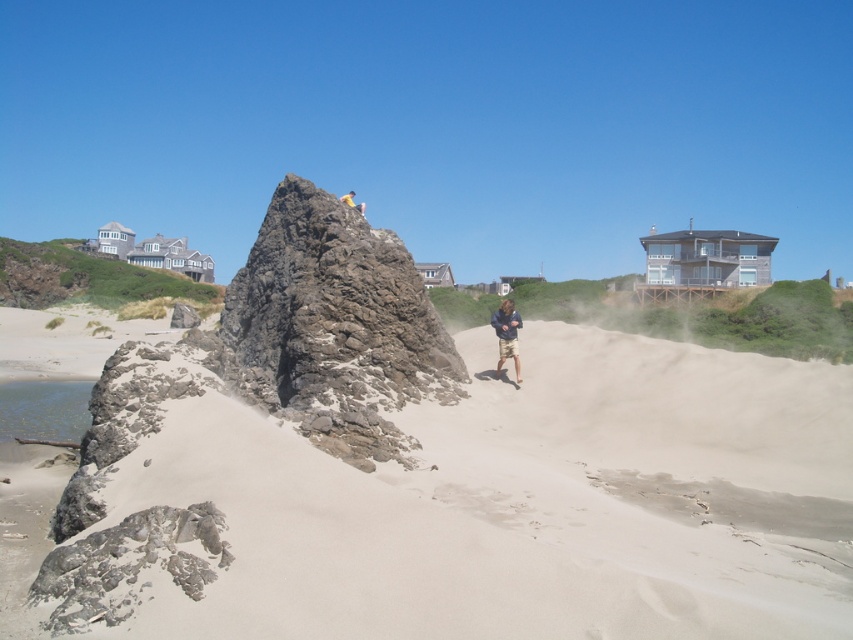
Question: Is the position of smooth beige sand at center more distant than that of dark blue jacket at center?

Choices:
 (A) yes
 (B) no

Answer: (B)

Question: Is smooth beige sand at center smaller than dark blue jacket at center?

Choices:
 (A) yes
 (B) no

Answer: (B)

Question: Among these objects, which one is nearest to the camera?

Choices:
 (A) dark blue jacket at center
 (B) smooth beige sand at center

Answer: (B)

Question: Is smooth beige sand at center further to camera compared to brown rough rock at center?

Choices:
 (A) yes
 (B) no

Answer: (B)

Question: Which point appears closest to the camera in this image?

Choices:
 (A) (503, 305)
 (B) (711, 493)

Answer: (B)

Question: Which of the following is the closest to the observer?

Choices:
 (A) (268, 252)
 (B) (509, 356)
 (C) (135, 477)

Answer: (C)